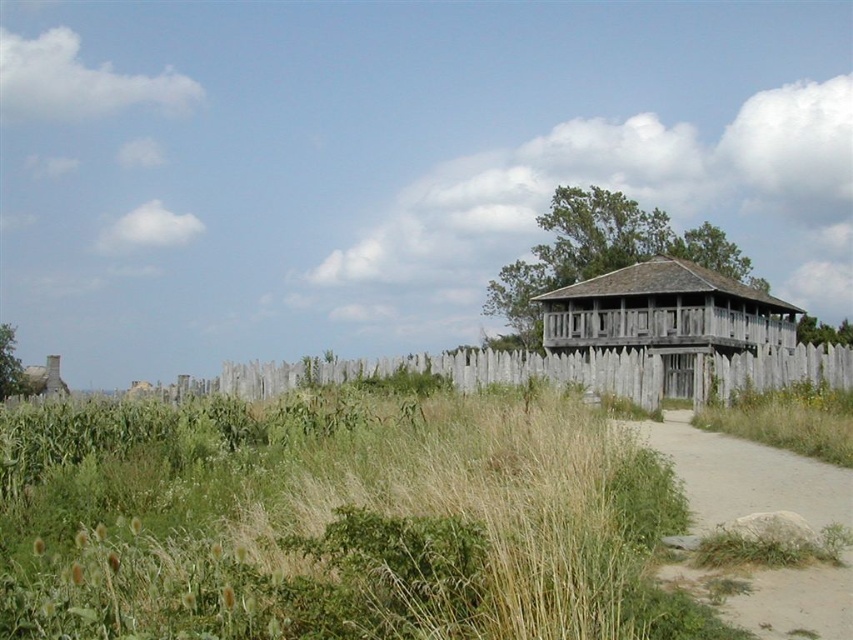
You are standing at the base of the rustic wooden structure and want to walk towards the dirt path at lower right. Which direction should you head relative to the green grass at center?

You should head to the right side of the green grass at center to reach the dirt path at lower right, since the green grass at center is positioned on the left side of the dirt path at lower right.